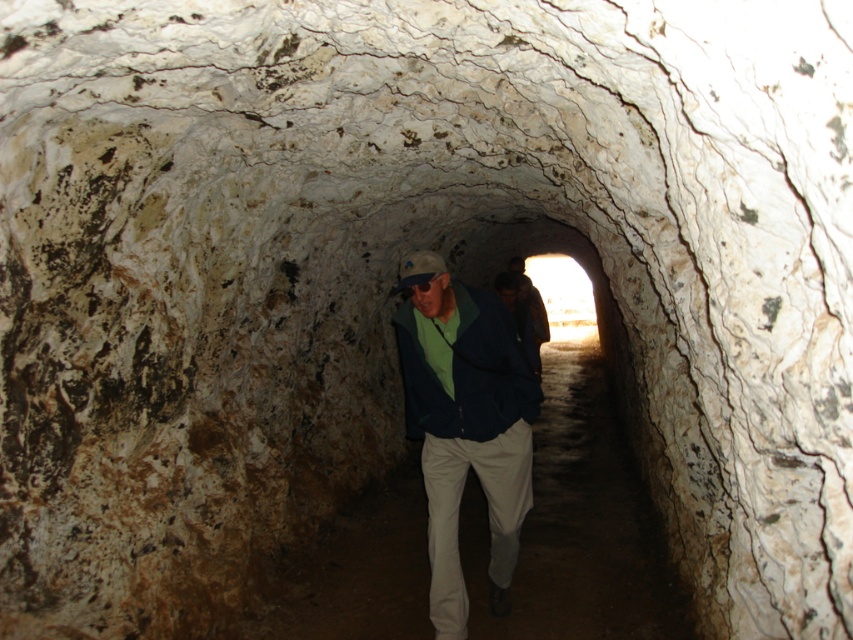
You are a tour guide leading a group through the ancient tunnel. You notice two jackets hanging on a rack near the entrance. The matte green jacket at center and the dark brown leather jacket at center. A visitor asks if they can fit both jackets side by side on a shelf that is 12 feet long. What do you tell them?

The matte green jacket at center is 11.62 feet away from dark brown leather jacket at center. Since the distance between them is less than 12 feet, both jackets can fit side by side on the 12 feet long shelf.

You are a tour guide leading a group through the ancient tunnel. You notice two jackets hanging on a hook at the center of the tunnel wall. The jackets are a matte blue jacket at center and a dark brown leather jacket at center. Which jacket is narrower in width?

The matte blue jacket at center is narrower in width than the dark brown leather jacket at center.

You are an explorer navigating through the ancient tunnel. You need to step onto the smooth stone path at center while wearing the dark brown leather jacket at center. Can you safely step onto the path without the jacket getting caught on anything?

The smooth stone path at center is located below dark brown leather jacket at center, so stepping onto the path should be possible as the jacket is positioned above it and unlikely to get caught on the path itself.